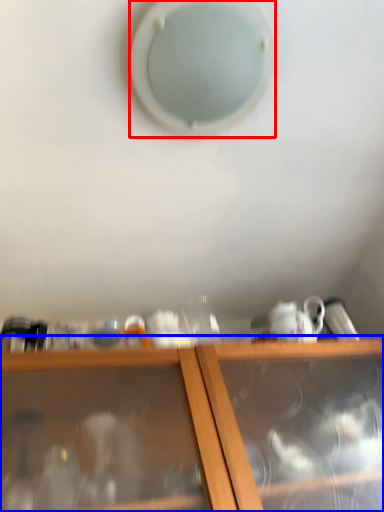
Question: Which object appears closest to the camera in this image, hole (highlighted by a red box) or shelf (highlighted by a blue box)?

Choices:
 (A) hole
 (B) shelf

Answer: (B)